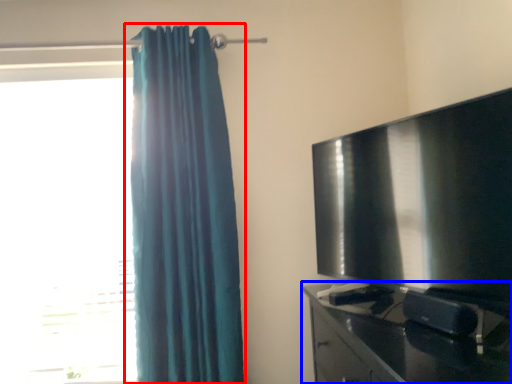
Question: Among these objects, which one is nearest to the camera, curtain (highlighted by a red box) or furniture (highlighted by a blue box)?

Choices:
 (A) curtain
 (B) furniture

Answer: (B)